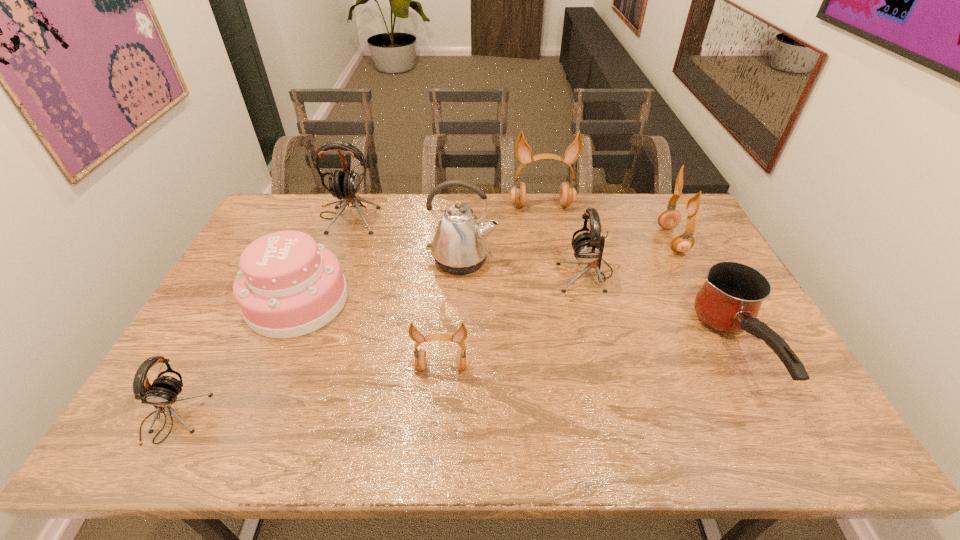
Locate an element on the screen. This screenshot has width=960, height=540. vacant area situated on the front-facing side of the second biggest brown earphone is located at coordinates (572, 240).

I want to click on free location located 0.390m on the front-facing side of the second biggest brown earphone, so click(x=546, y=240).

Identify the location of vacant region located 0.230m on the front of the pink birthday cake. (249, 418).

Where is `vacant region located on the front-facing side of the second nearest earphone`? This screenshot has height=540, width=960. vacant region located on the front-facing side of the second nearest earphone is located at coordinates (438, 417).

Locate an element on the screen. vacant area situated on the right of the leftmost earphone is located at coordinates (315, 418).

At what (x,y) coordinates should I click in order to perform the action: click on earphone that is at the near edge. Please return your answer as a coordinate pair (x, y). This screenshot has width=960, height=540. Looking at the image, I should click on (163, 392).

At what (x,y) coordinates should I click in order to perform the action: click on saucepan that is at the near edge. Please return your answer as a coordinate pair (x, y). Looking at the image, I should click on (729, 301).

Find the location of `birthday cake at the left edge`. birthday cake at the left edge is located at coordinates (288, 286).

Identify the location of earphone that is at the left edge. The width and height of the screenshot is (960, 540). click(x=163, y=392).

The width and height of the screenshot is (960, 540). I want to click on earphone at the right edge, so click(670, 218).